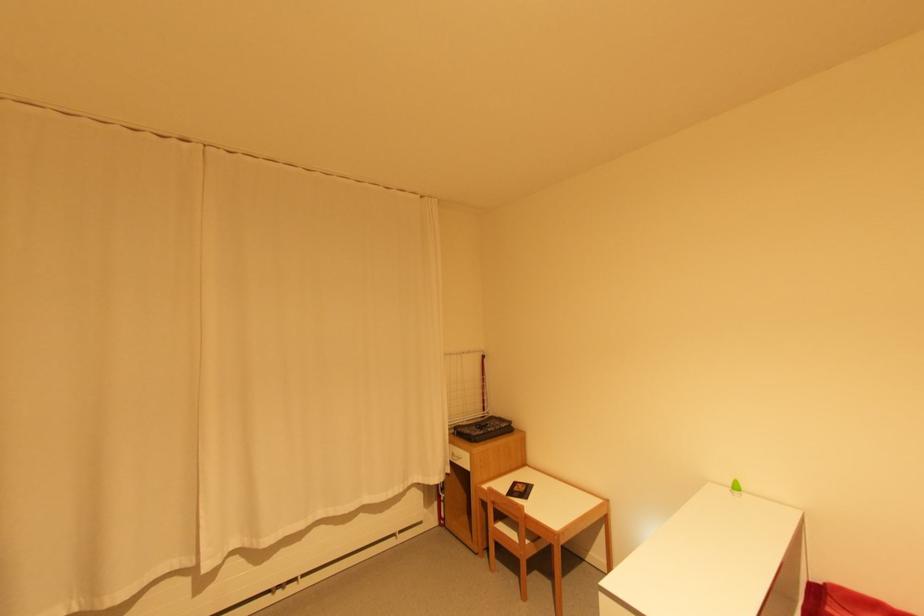
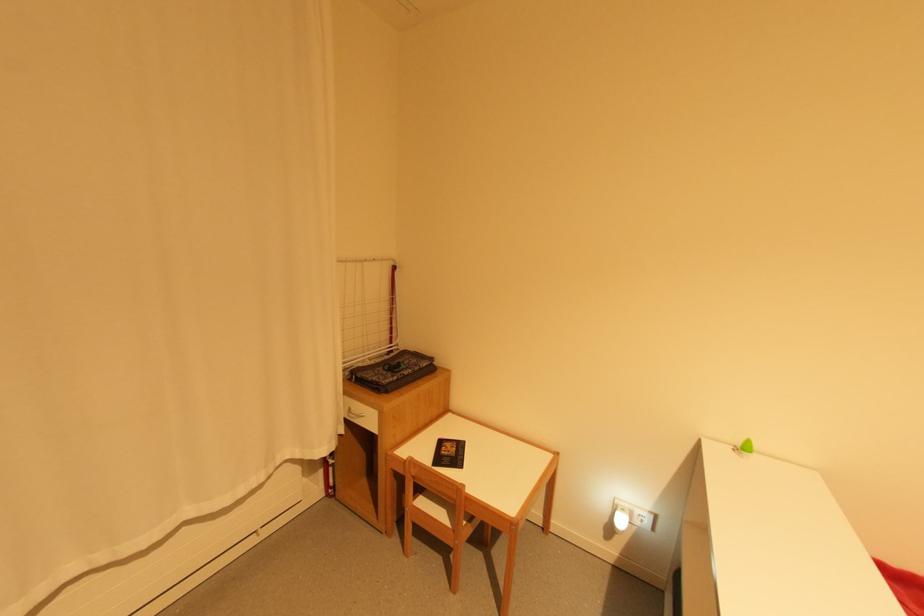
Where in the second image is the point corresponding to point 517,536 from the first image?

(445, 515)